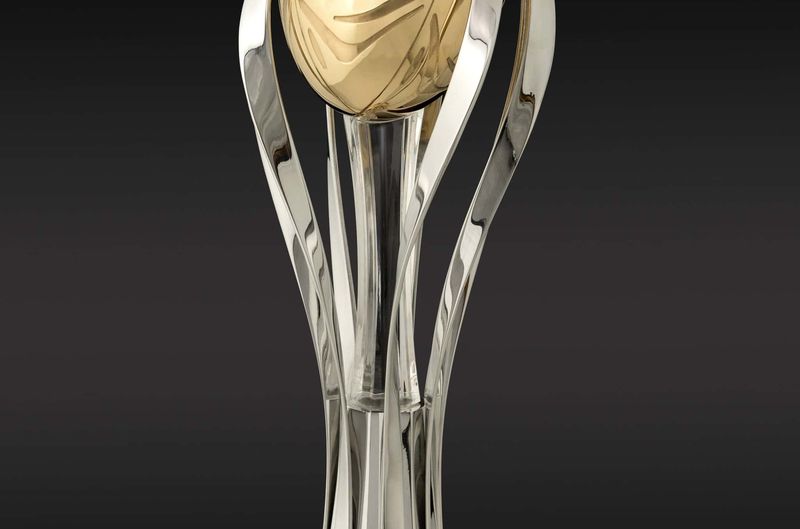
Where is `trophy`? trophy is located at coordinates (385, 485).